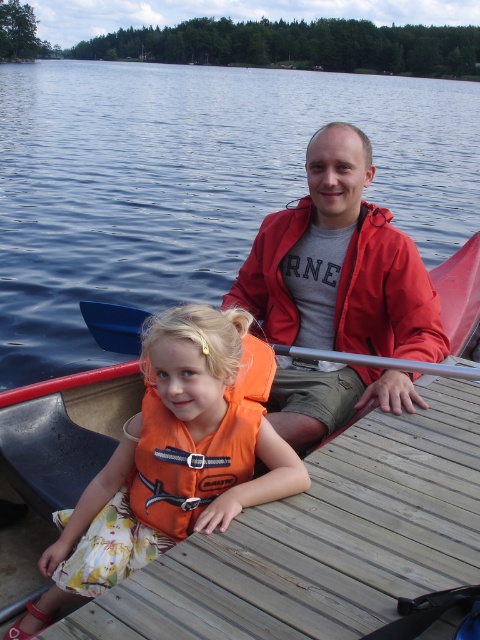
Question: Among these points, which one is farthest from the camera?

Choices:
 (A) (155, 448)
 (B) (76, 577)
 (C) (442, 339)
 (D) (277, 355)

Answer: (D)

Question: Does blue water at center lie behind orange life vest at center?

Choices:
 (A) yes
 (B) no

Answer: (A)

Question: Which point is closer to the camera taking this photo?

Choices:
 (A) (153, 168)
 (B) (233, 448)
 (C) (308, 429)

Answer: (B)

Question: Is the position of orange life vest at center more distant than that of smooth plastic paddle at center?

Choices:
 (A) no
 (B) yes

Answer: (A)

Question: Does orange fabric life jacket at center have a smaller size compared to smooth plastic paddle at center?

Choices:
 (A) no
 (B) yes

Answer: (A)

Question: Which object appears closest to the camera in this image?

Choices:
 (A) blue water at center
 (B) smooth plastic paddle at center

Answer: (B)